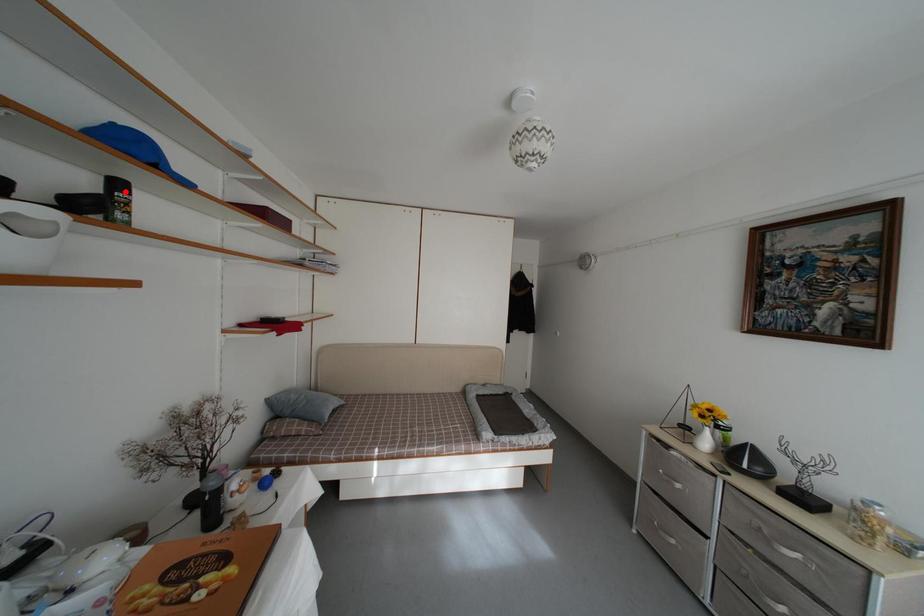
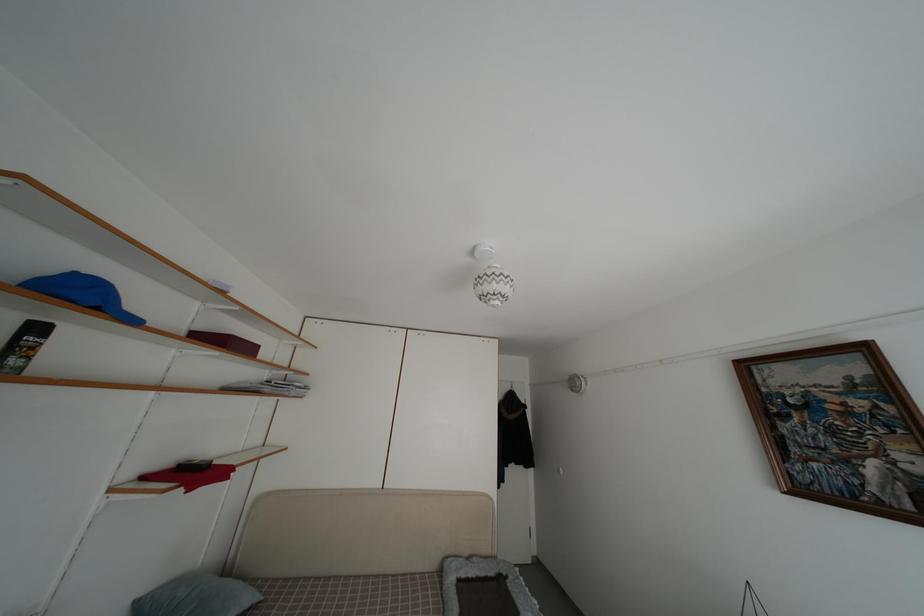
In the second image, find the point that corresponds to the highlighted location in the first image.

(43, 334)